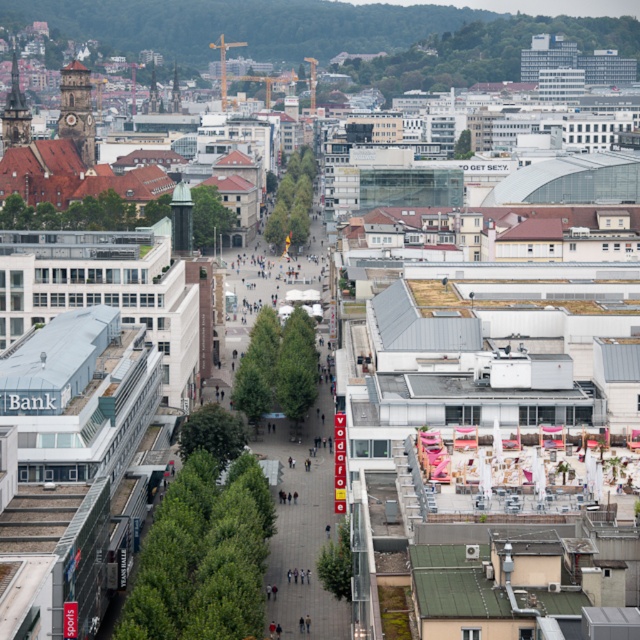
You are standing at the center of the pedestrian street in the image. Which direction should you walk to reach the brown stone clock tower at upper left?

Since the brown stone clock tower at upper left is located at point coordinates of (76, 109), you should walk towards the upper left direction to reach it.

In the scene shown: You are standing at the center of the pedestrian street and looking towards the upper left corner of the image. Which of the two towers, the brown stone clock tower at upper left or the dark brown stone tower at upper left, appears closer to you?

The brown stone clock tower at upper left appears closer because it is further to the viewer than the dark brown stone tower at upper left.